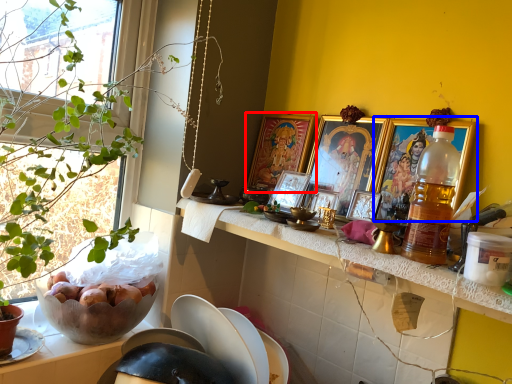
Question: Which object appears farthest to the camera in this image, picture frame (highlighted by a red box) or picture frame (highlighted by a blue box)?

Choices:
 (A) picture frame
 (B) picture frame

Answer: (A)